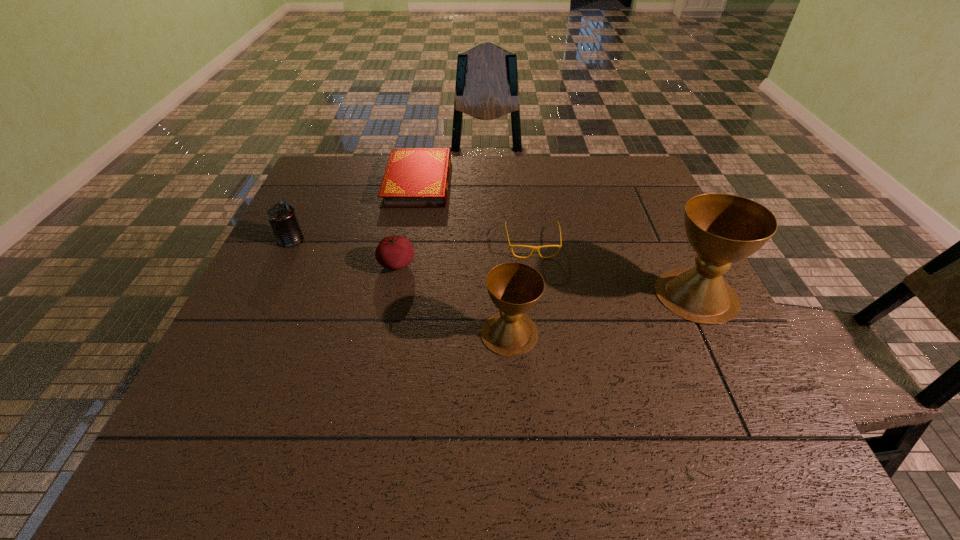
Locate an element on the screen. The width and height of the screenshot is (960, 540). the second tallest object is located at coordinates (514, 288).

The height and width of the screenshot is (540, 960). I want to click on the shorter chalice, so click(514, 288).

Where is `the right chalice`? The height and width of the screenshot is (540, 960). the right chalice is located at coordinates (722, 228).

Where is `the taller chalice`? The width and height of the screenshot is (960, 540). the taller chalice is located at coordinates (722, 228).

The width and height of the screenshot is (960, 540). What are the coordinates of `hardback book` in the screenshot? It's located at (414, 177).

In order to click on spectacles in this screenshot , I will do pyautogui.click(x=511, y=246).

Find the location of `the fourth shortest object`. the fourth shortest object is located at coordinates (282, 217).

At what (x,y) coordinates should I click in order to perform the action: click on can. Please return your answer as a coordinate pair (x, y). The image size is (960, 540). Looking at the image, I should click on (282, 217).

You are a GUI agent. You are given a task and a screenshot of the screen. Output one action in this format:
    pyautogui.click(x=<x>, y=<y>)
    Task: Click on the tomato
    Image resolution: width=960 pixels, height=540 pixels.
    Given the screenshot: What is the action you would take?
    pyautogui.click(x=393, y=252)

Identify the location of free space located on the right of the shorter chalice. (643, 333).